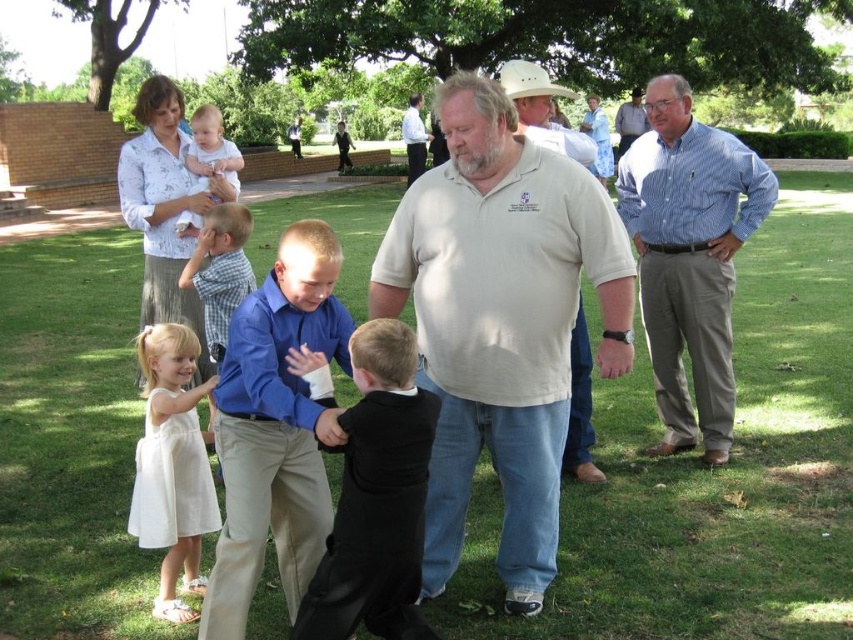
Can you confirm if white cotton shirt at center is bigger than light blue shirt at center?

Correct, white cotton shirt at center is larger in size than light blue shirt at center.

Looking at this image, between white cotton shirt at center and light blue shirt at center, which one has less height?

light blue shirt at center

Where is `white cotton shirt at center`? The image size is (853, 640). white cotton shirt at center is located at coordinates (502, 321).

You are a GUI agent. You are given a task and a screenshot of the screen. Output one action in this format:
    pyautogui.click(x=<x>, y=<y>)
    Task: Click on the white cotton shirt at center
    This screenshot has height=640, width=853.
    Given the screenshot: What is the action you would take?
    pyautogui.click(x=502, y=321)

Does soft white fabric baby at upper left appear over light beige shirt at center?

Actually, soft white fabric baby at upper left is below light beige shirt at center.

Between soft white fabric baby at upper left and light beige shirt at center, which one appears on the right side from the viewer's perspective?

From the viewer's perspective, light beige shirt at center appears more on the right side.

Is point (230, 177) positioned before point (413, 148)?

That is True.

At what (x,y) coordinates should I click in order to perform the action: click on soft white fabric baby at upper left. Please return your answer as a coordinate pair (x, y). The height and width of the screenshot is (640, 853). Looking at the image, I should click on (212, 150).

Can you confirm if blue striped shirt at right is positioned above soft white fabric baby at upper left?

Actually, blue striped shirt at right is below soft white fabric baby at upper left.

Is blue striped shirt at right behind soft white fabric baby at upper left?

No.

Does point (695, 140) come behind point (223, 141)?

No, (695, 140) is closer to viewer.

Find the location of `blue striped shirt at right`. blue striped shirt at right is located at coordinates (689, 257).